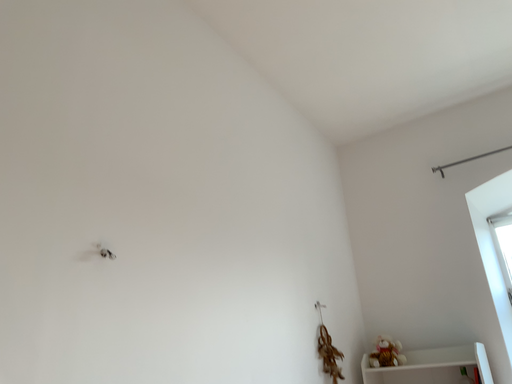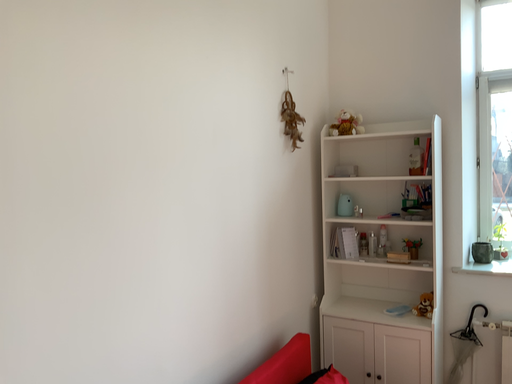
Question: How did the camera likely rotate when shooting the video?

Choices:
 (A) rotated downward
 (B) rotated upward

Answer: (A)